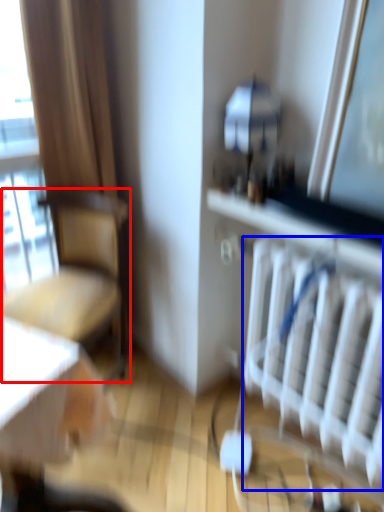
Question: Which object is closer to the camera taking this photo, chair (highlighted by a red box) or radiator (highlighted by a blue box)?

Choices:
 (A) chair
 (B) radiator

Answer: (B)